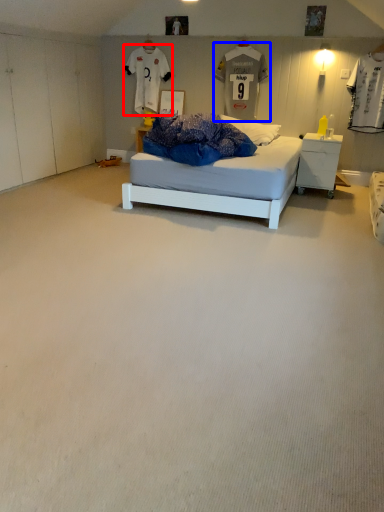
Question: Which point is further to the camera, t shirt (highlighted by a red box) or t shirt (highlighted by a blue box)?

Choices:
 (A) t shirt
 (B) t shirt

Answer: (A)